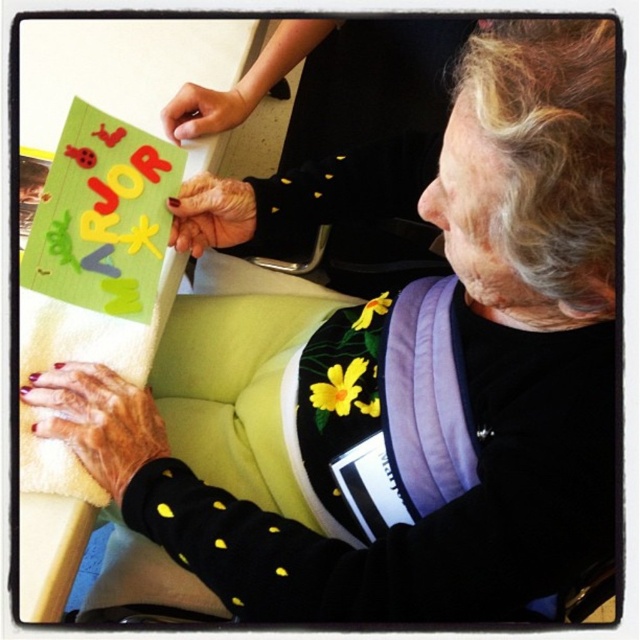
Is green felt sign at upper left to the left of matte skin hand at upper center from the viewer's perspective?

Indeed, green felt sign at upper left is positioned on the left side of matte skin hand at upper center.

Does green felt sign at upper left appear under matte skin hand at upper center?

Indeed, green felt sign at upper left is positioned under matte skin hand at upper center.

Image resolution: width=640 pixels, height=640 pixels. Find the location of `green felt sign at upper left`. green felt sign at upper left is located at coordinates (102, 216).

Between nail polish painted fingernails at lower left and matte skin hand at upper center, which one is positioned lower?

Positioned lower is nail polish painted fingernails at lower left.

Who is positioned more to the right, nail polish painted fingernails at lower left or matte skin hand at upper center?

matte skin hand at upper center

Does point (104, 376) lie in front of point (186, 106)?

Yes, point (104, 376) is in front of point (186, 106).

Image resolution: width=640 pixels, height=640 pixels. I want to click on nail polish painted fingernails at lower left, so click(x=97, y=420).

Who is more forward, (243, 218) or (180, 115)?

Point (243, 218) is more forward.

Is point (193, 240) positioned behind point (216, 108)?

No.

Locate an element on the screen. Image resolution: width=640 pixels, height=640 pixels. smooth skin hand at center is located at coordinates (211, 214).